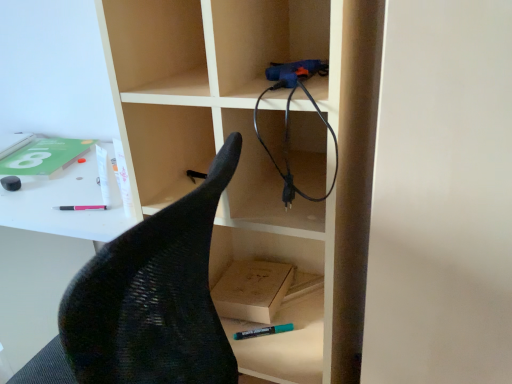
Identify the location of free space above black mesh chair at left (from a real-world perspective). (45, 166).